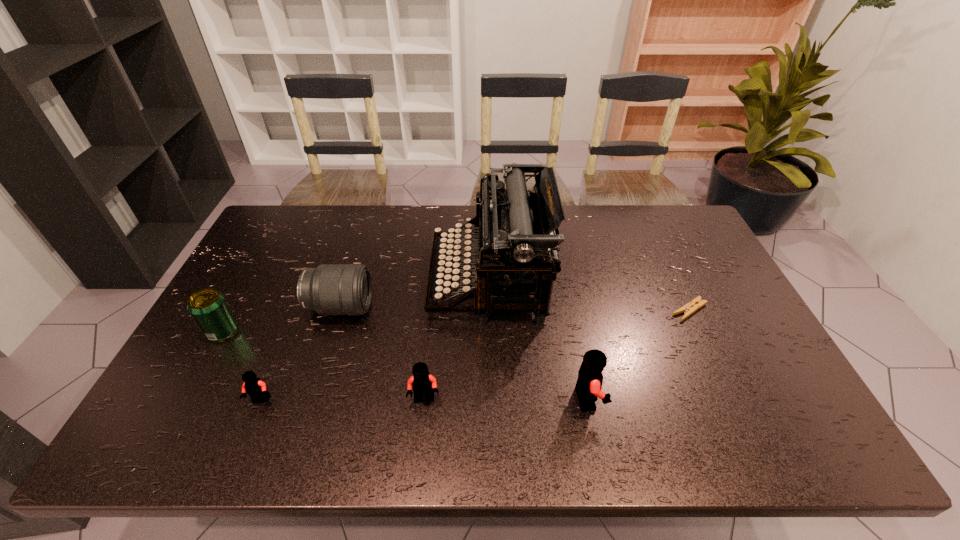
With all Legos evenly spaced, where should an extra Lego be placed on the right to continue the pattern? Please point out a vacant space. Please provide its 2D coordinates. Your answer should be formatted as a tuple, i.e. [(x, y)], where the tuple contains the x and y coordinates of a point satisfying the conditions above.

[(751, 397)]